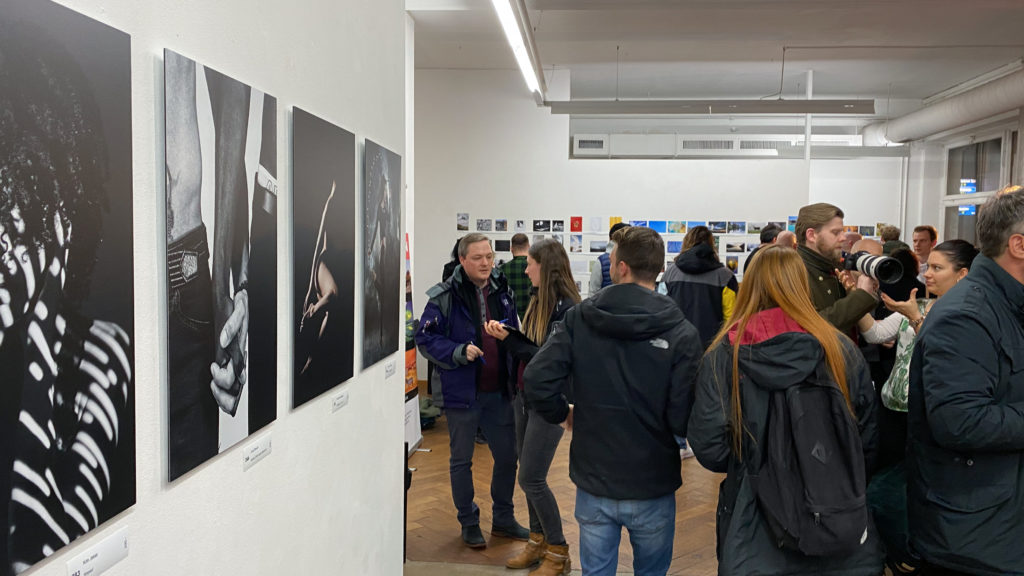
At what (x,y) coordinates should I click in order to perform the action: click on photographs onleft wall. Please return your answer as a coordinate pair (x, y). This screenshot has height=576, width=1024. Looking at the image, I should click on (376, 260), (328, 263), (226, 274), (75, 297).